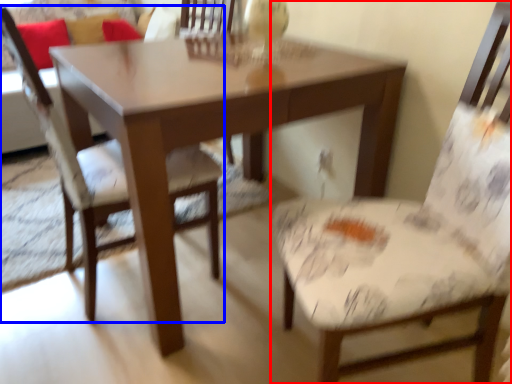
Question: Which object is closer to the camera taking this photo, chair (highlighted by a red box) or chair (highlighted by a blue box)?

Choices:
 (A) chair
 (B) chair

Answer: (A)